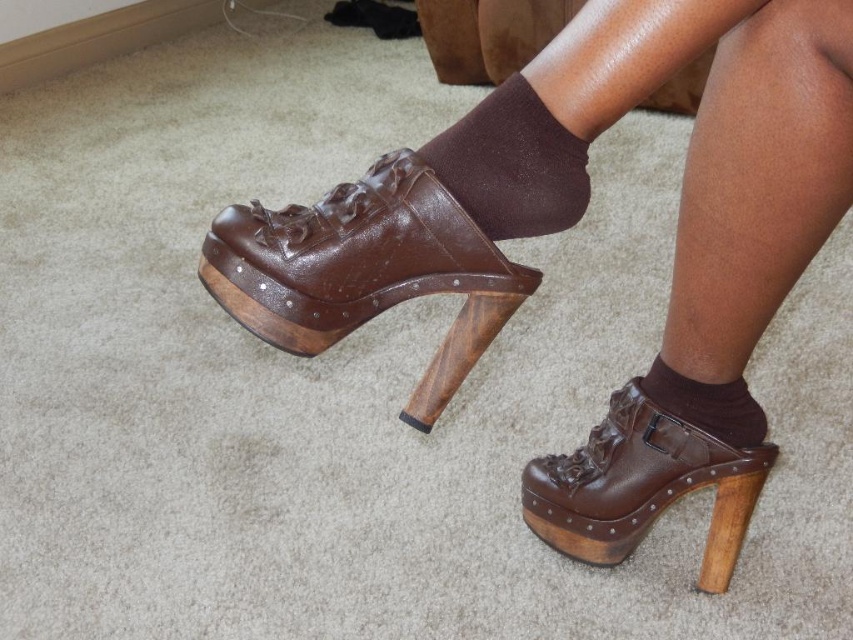
You are trying to put on your brown leather clog at center and brown smooth sock at lower center. Which one should you put on first?

You should put on the brown smooth sock at lower center first because the brown leather clog at center is to the left of it, indicating it should be placed over the sock.

You are a fashion designer examining a model wearing the brown leather clog at center and the brown leather platform shoe at center. Which shoe is covering the other?

The brown leather clog at center is positioned over the brown leather platform shoe at center, so it is covering it.

You are trying to choose between the brown leather clog at center and the brown leather platform shoe at center for a costume that requires ankle coverage. Which one would provide better ankle coverage?

The brown leather clog at center is taller than the brown leather platform shoe at center, so it would provide better ankle coverage.